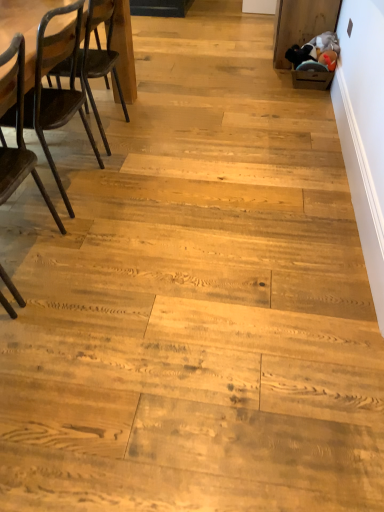
At what (x,y) coordinates should I click in order to perform the action: click on empty space that is in between dark brown wood table at left and dark brown wood chair at left, positioned as the 2th chair in front-to-back order. Please return your answer as a coordinate pair (x, y). The width and height of the screenshot is (384, 512). Looking at the image, I should click on (81, 160).